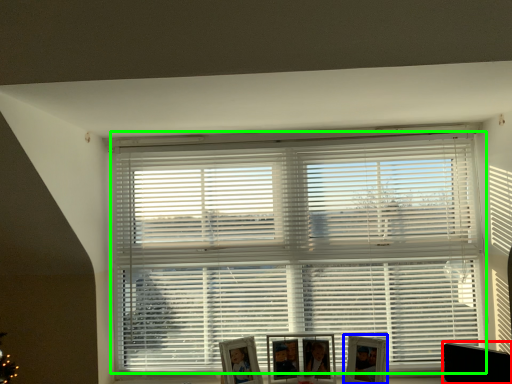
Question: Considering the real-world distances, which object is farthest from swivel chair (highlighted by a red box)? picture frame (highlighted by a blue box) or window blind (highlighted by a green box)?

Choices:
 (A) picture frame
 (B) window blind

Answer: (B)